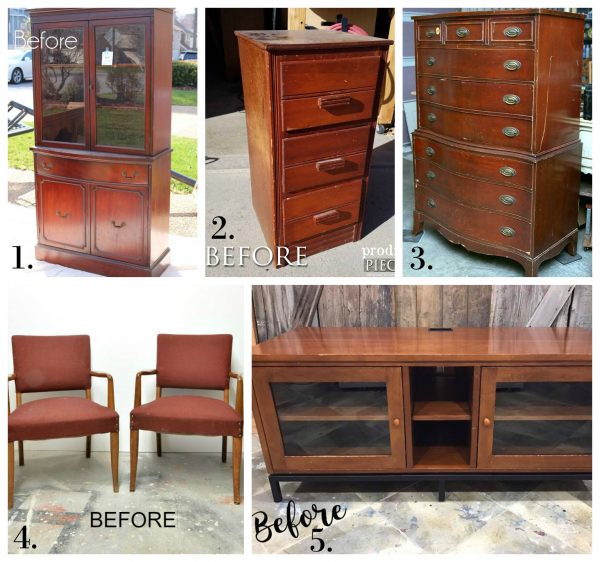
The height and width of the screenshot is (562, 600). In order to click on glass doors on small wooden cabinet in this screenshot , I will do `click(107, 108)`.